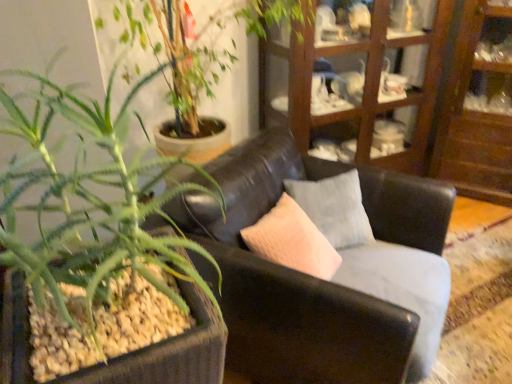
Question: Is wooden cabinet at upper right looking in the opposite direction of wooden cabinet at upper right?

Choices:
 (A) no
 (B) yes

Answer: (A)

Question: Is wooden cabinet at upper right located within wooden cabinet at upper right?

Choices:
 (A) yes
 (B) no

Answer: (B)

Question: Is wooden cabinet at upper right thinner than wooden cabinet at upper right?

Choices:
 (A) yes
 (B) no

Answer: (B)

Question: Can you confirm if wooden cabinet at upper right is taller than wooden cabinet at upper right?

Choices:
 (A) no
 (B) yes

Answer: (B)

Question: Would you consider wooden cabinet at upper right to be distant from wooden cabinet at upper right?

Choices:
 (A) no
 (B) yes

Answer: (A)

Question: From their relative heights in the image, would you say black leather couch at center is taller or shorter than wooden cabinet at upper right?

Choices:
 (A) tall
 (B) short

Answer: (B)

Question: Considering the positions of black leather couch at center and wooden cabinet at upper right in the image, is black leather couch at center wider or thinner than wooden cabinet at upper right?

Choices:
 (A) wide
 (B) thin

Answer: (A)

Question: Does point (337, 380) appear closer or farther from the camera than point (411, 43)?

Choices:
 (A) closer
 (B) farther

Answer: (A)

Question: Would you say black leather couch at center is to the left or to the right of wooden cabinet at upper right in the picture?

Choices:
 (A) left
 (B) right

Answer: (A)

Question: In the image, is wooden cabinet at upper right on the left side or the right side of green succulent at left?

Choices:
 (A) right
 (B) left

Answer: (A)

Question: Based on their sizes in the image, would you say wooden cabinet at upper right is bigger or smaller than green succulent at left?

Choices:
 (A) small
 (B) big

Answer: (B)

Question: Looking at their shapes, would you say wooden cabinet at upper right is wider or thinner than green succulent at left?

Choices:
 (A) thin
 (B) wide

Answer: (A)

Question: Relative to green succulent at left, is wooden cabinet at upper right in front or behind?

Choices:
 (A) behind
 (B) front

Answer: (A)

Question: From the image's perspective, is wooden cabinet at upper right above or below black leather couch at center?

Choices:
 (A) below
 (B) above

Answer: (B)

Question: Considering the positions of wooden cabinet at upper right and black leather couch at center in the image, is wooden cabinet at upper right taller or shorter than black leather couch at center?

Choices:
 (A) short
 (B) tall

Answer: (B)